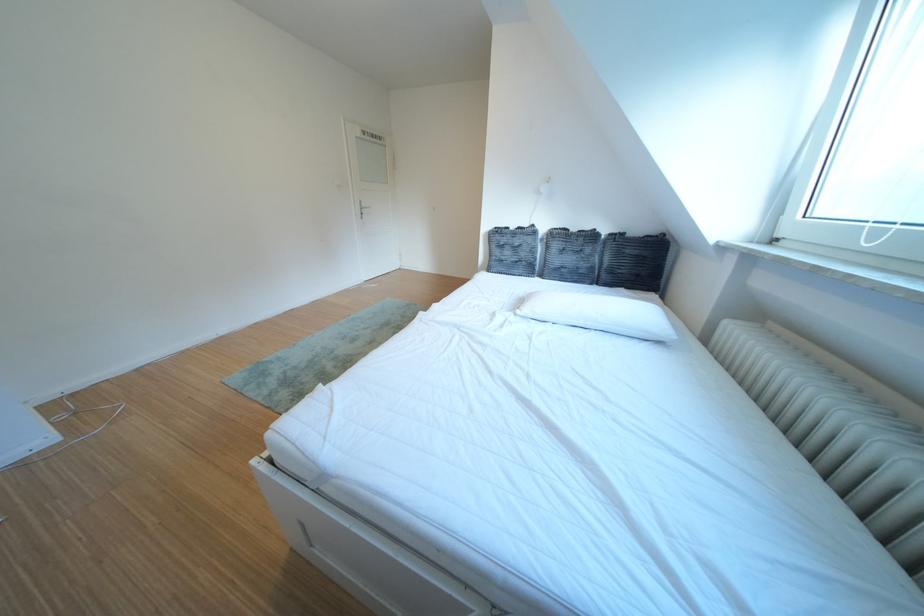
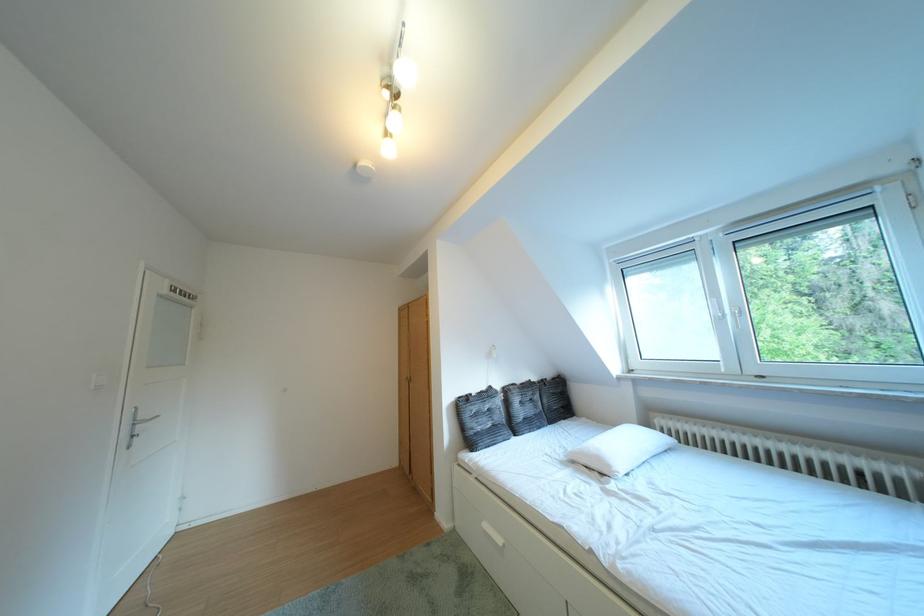
Find the pixel in the second image that matches (x=507, y=264) in the first image.

(484, 438)